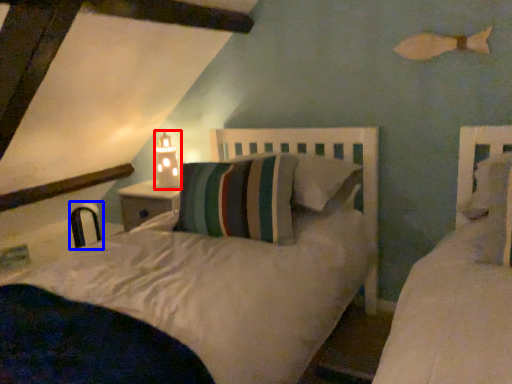
Question: Which point is closer to the camera, table lamp (highlighted by a red box) or chair (highlighted by a blue box)?

Choices:
 (A) table lamp
 (B) chair

Answer: (A)